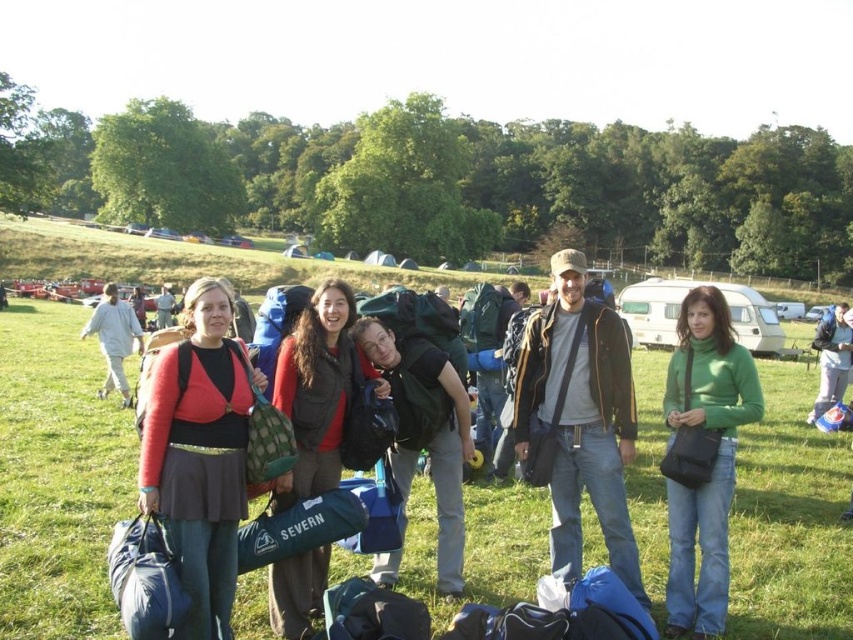
Does blue backpack at center have a greater height compared to matte black backpack at center?

In fact, blue backpack at center may be shorter than matte black backpack at center.

Does blue backpack at center appear on the left side of matte black backpack at center?

In fact, blue backpack at center is to the right of matte black backpack at center.

Between point (822, 330) and point (161, 304), which one is positioned in front?

Point (822, 330) is more forward.

Where is `blue backpack at center`? blue backpack at center is located at coordinates click(833, 358).

Does brown leather jacket at center appear over green matte backpack at center?

Incorrect, brown leather jacket at center is not positioned above green matte backpack at center.

Locate an element on the screen. The width and height of the screenshot is (853, 640). brown leather jacket at center is located at coordinates [579, 419].

Is point (569, 305) less distant than point (440, 580)?

No, it is not.

Locate an element on the screen. brown leather jacket at center is located at coordinates (579, 419).

Can you confirm if green matte backpack at center is positioned below matte black backpack at center?

Correct, green matte backpack at center is located below matte black backpack at center.

Can you confirm if green matte backpack at center is positioned to the right of matte black backpack at center?

Yes, green matte backpack at center is to the right of matte black backpack at center.

Is point (416, 346) positioned in front of point (163, 301)?

That is True.

Where is `green matte backpack at center`? The height and width of the screenshot is (640, 853). green matte backpack at center is located at coordinates (425, 432).